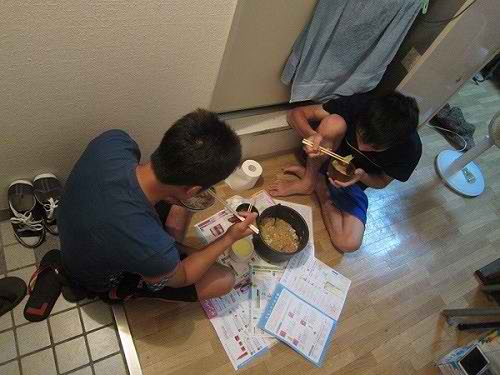
At what (x,y) coordinates should I click in order to perform the action: click on wood panel floor. Please return your answer as a coordinate pair (x, y). The height and width of the screenshot is (375, 500). Looking at the image, I should click on (396, 266).